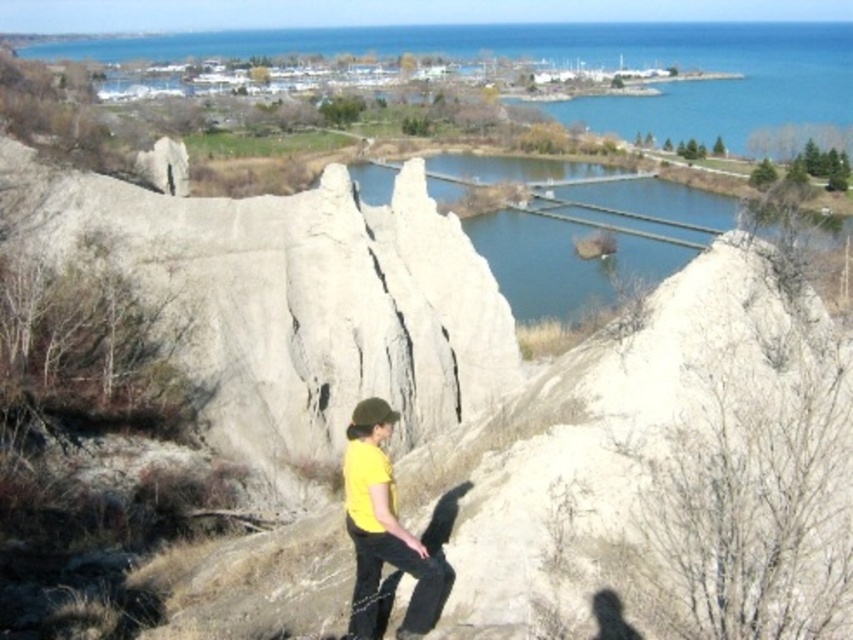
Question: Which object appears closest to the camera in this image?

Choices:
 (A) blue water at upper center
 (B) greenish-blue water at center
 (C) white sandy cliff at center
 (D) white rough rock at center

Answer: (C)

Question: Can you confirm if white sandy cliff at center is positioned to the left of greenish-blue water at center?

Choices:
 (A) no
 (B) yes

Answer: (B)

Question: Which object is positioned farthest from the blue water at upper center?

Choices:
 (A) greenish-blue water at center
 (B) white sandy cliff at center
 (C) white rough rock at center
 (D) yellow matte shirt at center

Answer: (D)

Question: Observing the image, what is the correct spatial positioning of white sandy cliff at center in reference to blue water at upper center?

Choices:
 (A) left
 (B) right

Answer: (B)

Question: Considering the relative positions of white rough rock at center and greenish-blue water at center in the image provided, where is white rough rock at center located with respect to greenish-blue water at center?

Choices:
 (A) above
 (B) below

Answer: (B)

Question: Which point is closer to the camera taking this photo?

Choices:
 (A) (251, 260)
 (B) (361, 504)

Answer: (B)